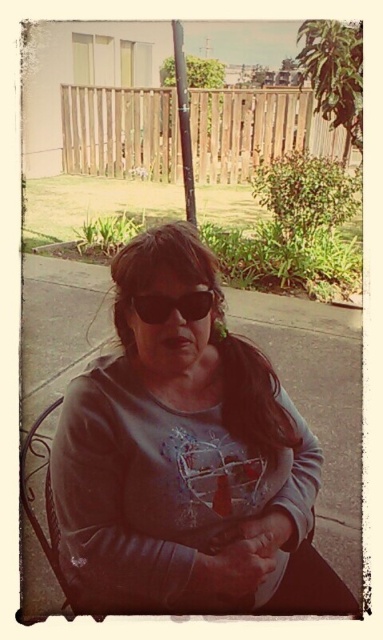
Can you confirm if gray fleece sweatshirt at center is positioned above black plastic sunglasses at center?

Incorrect, gray fleece sweatshirt at center is not positioned above black plastic sunglasses at center.

Does gray fleece sweatshirt at center have a greater height compared to black plastic sunglasses at center?

Yes, gray fleece sweatshirt at center is taller than black plastic sunglasses at center.

Is point (255, 604) in front of point (196, 310)?

No, (255, 604) is behind (196, 310).

You are a GUI agent. You are given a task and a screenshot of the screen. Output one action in this format:
    pyautogui.click(x=<x>, y=<y>)
    Task: Click on the gray fleece sweatshirt at center
    
    Given the screenshot: What is the action you would take?
    pyautogui.click(x=180, y=451)